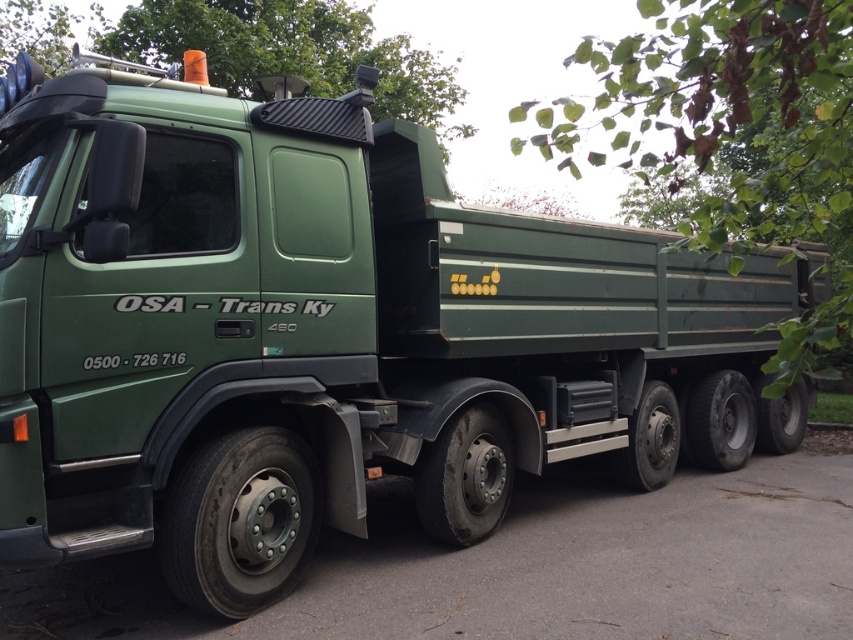
Does green matte truck at center have a lesser height compared to green corrugated metal roof at upper center?

No.

Between point (709, 45) and point (311, 92), which one is positioned in front?

Point (709, 45) is more forward.

Find the location of a particular element. The image size is (853, 640). green matte truck at center is located at coordinates 740,109.